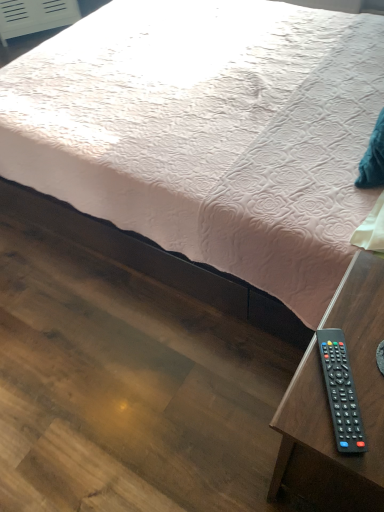
This screenshot has height=512, width=384. Identify the location of free space above black plastic remote at lower right (from a real-world perspective). (345, 346).